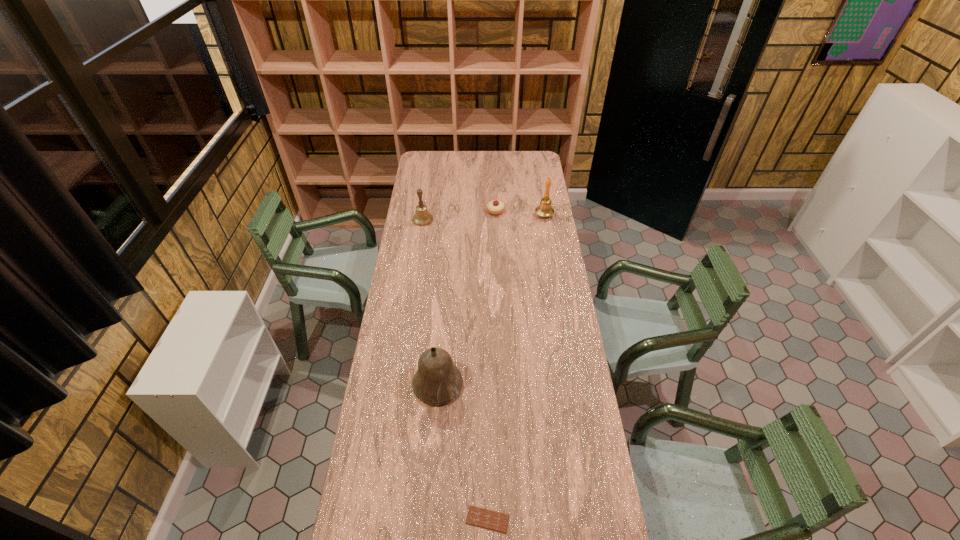
Locate an element on the screen. This screenshot has width=960, height=540. the rightmost object is located at coordinates (545, 209).

At what (x,y) coordinates should I click in order to perform the action: click on the second nearest object. Please return your answer as a coordinate pair (x, y). Looking at the image, I should click on (438, 381).

In order to click on the second shortest object in this screenshot , I will do `click(495, 207)`.

I want to click on the nearest object, so click(x=479, y=517).

At what (x,y) coordinates should I click in order to perform the action: click on chocolate bar. Please return your answer as a coordinate pair (x, y). Image resolution: width=960 pixels, height=540 pixels. Looking at the image, I should click on (479, 517).

Locate an element on the screen. Image resolution: width=960 pixels, height=540 pixels. vacant space located on the back of the rightmost bell is located at coordinates (537, 170).

In order to click on vacant region located on the front of the nearest bell in this screenshot , I will do `click(428, 511)`.

Image resolution: width=960 pixels, height=540 pixels. Find the location of `vacant space located on the right of the fourth tallest object`. vacant space located on the right of the fourth tallest object is located at coordinates (528, 211).

Find the location of `vacant space located 0.110m on the right of the shortest object`. vacant space located 0.110m on the right of the shortest object is located at coordinates (545, 519).

The image size is (960, 540). I want to click on object present at the right edge, so click(545, 209).